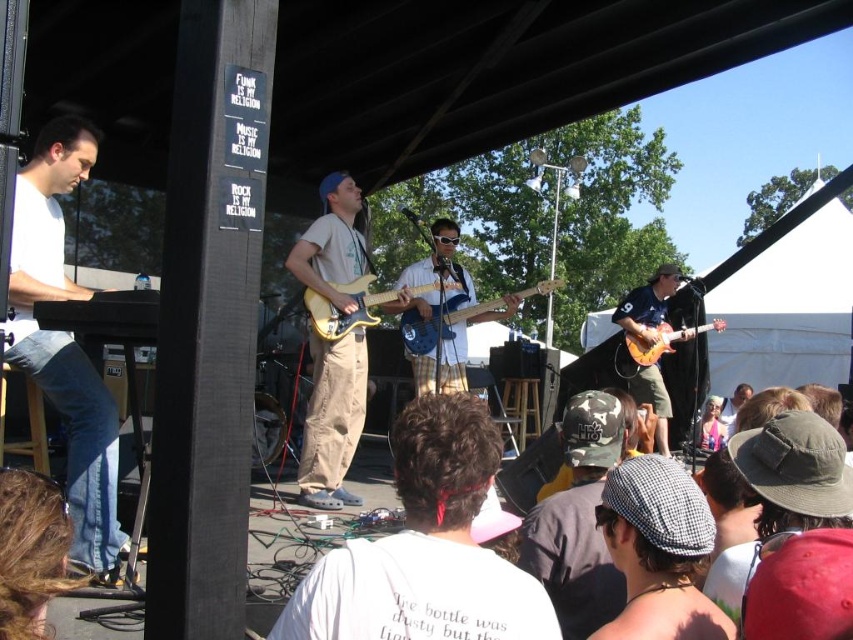
You are a photographer standing in front of the stage. You want to take a photo of the two points labeled as point (651, 285) and point (561, 282). Which point should you focus on first to ensure both are in focus?

Point (651, 285) is further to the camera than point (561, 282). To ensure both are in focus, focus on point (651, 285) first as it is closer to the camera, allowing the depth of field to cover the farther point as well.

Based on the photo, you are a stagehand setting up for a performance. You need to place a new microphone stand between the yellow matte electric guitar at center and the pink fabric at center. Considering their widths, which object should the stand be closer to?

The yellow matte electric guitar at center has a lesser width compared to the pink fabric at center, so the microphone stand should be placed closer to the yellow matte electric guitar at center to ensure adequate space between them.